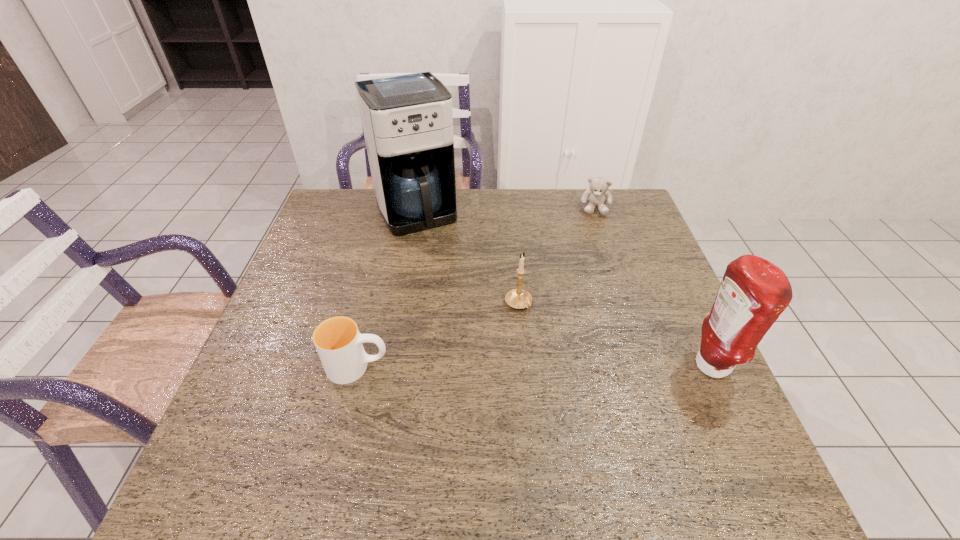
This screenshot has height=540, width=960. Identify the location of condiment present at the right edge. (753, 293).

Image resolution: width=960 pixels, height=540 pixels. Find the location of `teddy bear that is at the right edge`. teddy bear that is at the right edge is located at coordinates (596, 196).

Where is `object that is at the far right corner`? object that is at the far right corner is located at coordinates (596, 196).

This screenshot has height=540, width=960. What are the coordinates of `blank space at the far edge of the desktop` in the screenshot? It's located at (577, 230).

In the image, there is a desktop. Identify the location of vacant space at the near edge. (514, 413).

This screenshot has width=960, height=540. In order to click on free space at the left edge of the desktop in this screenshot , I will do `click(336, 265)`.

The height and width of the screenshot is (540, 960). I want to click on free space at the right edge of the desktop, so click(628, 232).

This screenshot has width=960, height=540. I want to click on vacant space at the far left corner of the desktop, so click(362, 218).

Find the location of a particular element. The width and height of the screenshot is (960, 540). vacant space at the near left corner of the desktop is located at coordinates (261, 437).

In the image, there is a desktop. Find the location of `free space at the near right corner`. free space at the near right corner is located at coordinates (713, 409).